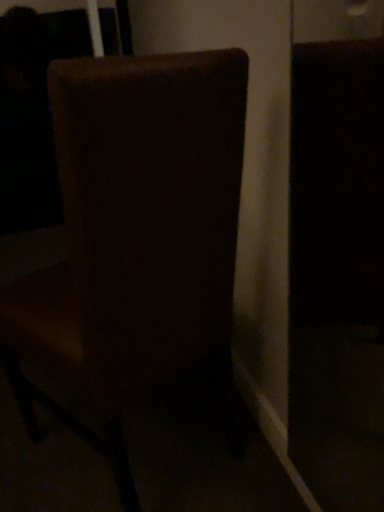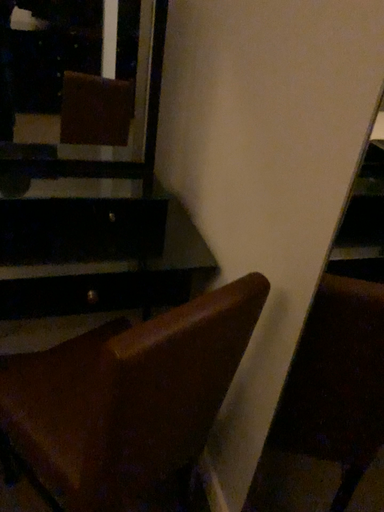
Question: Which way did the camera rotate in the video?

Choices:
 (A) rotated upward
 (B) rotated downward

Answer: (B)